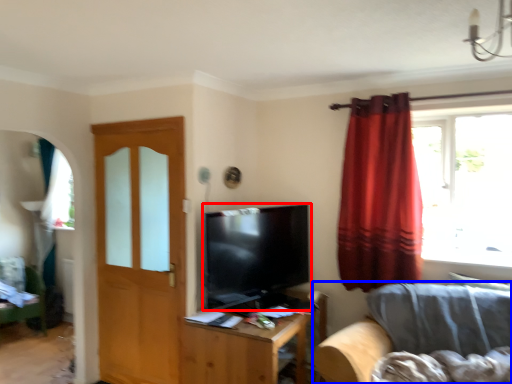
Question: Which point is further to the camera, television (highlighted by a red box) or studio couch (highlighted by a blue box)?

Choices:
 (A) television
 (B) studio couch

Answer: (A)